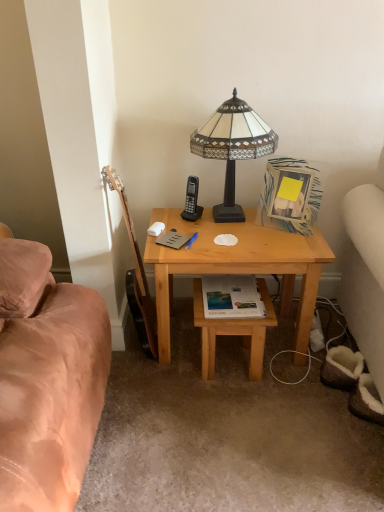
Question: Is black plastic phone at center in front of or behind matte paper book at center, positioned as the 1th book in bottom-to-top order, in the image?

Choices:
 (A) behind
 (B) front

Answer: (A)

Question: Considering the positions of black plastic phone at center and matte paper book at center, positioned as the second book in left-to-right order, in the image, is black plastic phone at center wider or thinner than matte paper book at center, positioned as the second book in left-to-right order,?

Choices:
 (A) thin
 (B) wide

Answer: (A)

Question: Considering the real-world distances, which object is farthest from the brown wood guitar at left?

Choices:
 (A) stained glass lampshade at upper center
 (B) black plastic phone at center
 (C) matte paper book at center, placed as the 2th book when sorted from top to bottom
 (D) light wood desk at center
 (E) light brown wooden stool at lower center

Answer: (A)

Question: Which of these objects is positioned farthest from the matte gray book at center, marked as the 1th book in a left-to-right arrangement?

Choices:
 (A) matte paper book at center, positioned as the 1th book in bottom-to-top order
 (B) black plastic phone at center
 (C) stained glass lampshade at upper center
 (D) light brown wooden stool at lower center
 (E) light wood desk at center

Answer: (C)